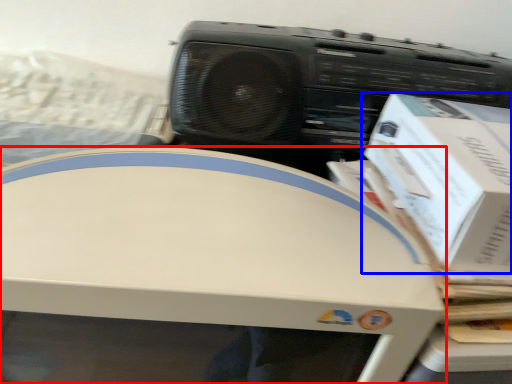
Question: Which point is closer to the camera, home appliance (highlighted by a red box) or box (highlighted by a blue box)?

Choices:
 (A) home appliance
 (B) box

Answer: (A)